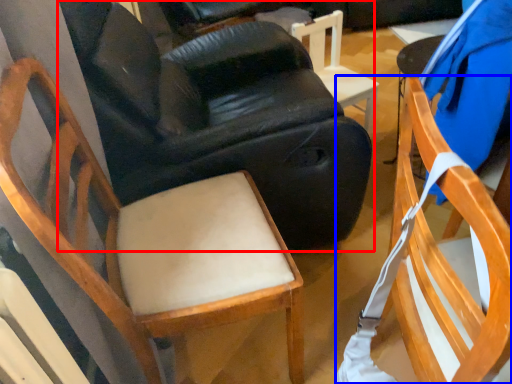
Question: Which point is closer to the camera, chair (highlighted by a red box) or chair (highlighted by a blue box)?

Choices:
 (A) chair
 (B) chair

Answer: (B)